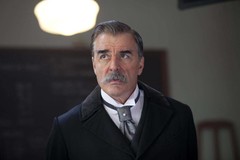
This screenshot has width=240, height=160. Identify the location of white wall. (197, 50).